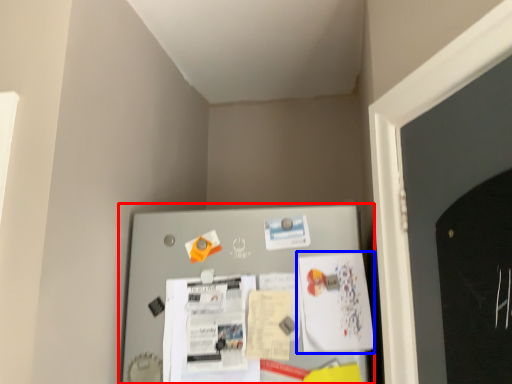
Question: Which object appears farthest to the camera in this image, bulletin board (highlighted by a red box) or poster (highlighted by a blue box)?

Choices:
 (A) bulletin board
 (B) poster

Answer: (B)